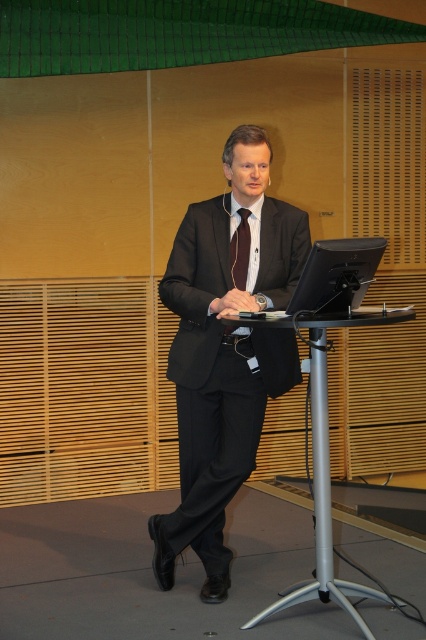
Question: Among these objects, which one is farthest from the camera?

Choices:
 (A) dark brown silk tie at center
 (B) silver metallic table at center
 (C) matte black suit at center
 (D) black glossy monitor at center

Answer: (A)

Question: Is matte black suit at center wider than black glossy monitor at center?

Choices:
 (A) yes
 (B) no

Answer: (A)

Question: Is black glossy monitor at center bigger than dark brown silk tie at center?

Choices:
 (A) no
 (B) yes

Answer: (B)

Question: Which object is positioned closest to the matte black suit at center?

Choices:
 (A) dark brown silk tie at center
 (B) silver metallic table at center

Answer: (B)

Question: Which is nearer to the dark brown silk tie at center?

Choices:
 (A) silver metallic table at center
 (B) black glossy monitor at center
 (C) matte black suit at center

Answer: (C)

Question: Is matte black suit at center above black glossy monitor at center?

Choices:
 (A) yes
 (B) no

Answer: (B)